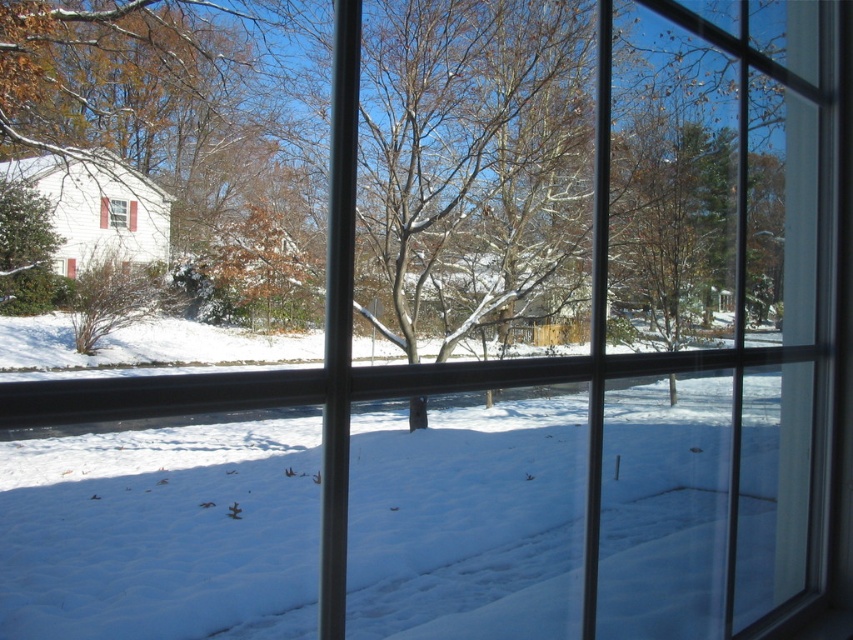
Question: Is matte white window at upper left thinner than clear glass window at center?

Choices:
 (A) no
 (B) yes

Answer: (A)

Question: Which point is closer to the camera taking this photo?

Choices:
 (A) (129, 224)
 (B) (120, 208)

Answer: (B)

Question: Which point appears closest to the camera in this image?

Choices:
 (A) 108,211
 (B) 106,209

Answer: (B)

Question: Observing the image, what is the correct spatial positioning of matte white window at upper left in reference to clear glass window at center?

Choices:
 (A) right
 (B) left

Answer: (A)

Question: Which point is closer to the camera?

Choices:
 (A) clear glass window at center
 (B) matte white window at upper left

Answer: (B)

Question: Is matte white window at upper left smaller than clear glass window at center?

Choices:
 (A) yes
 (B) no

Answer: (B)